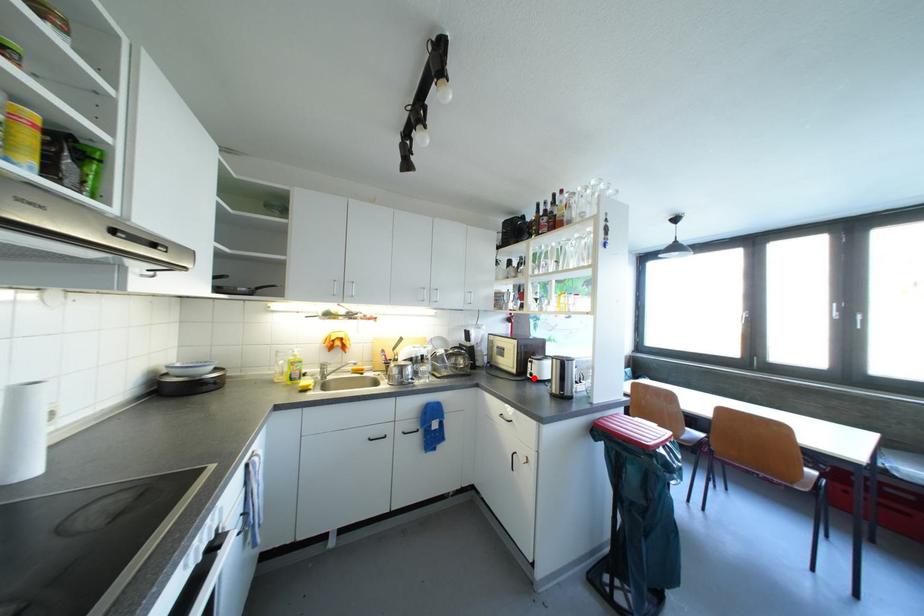
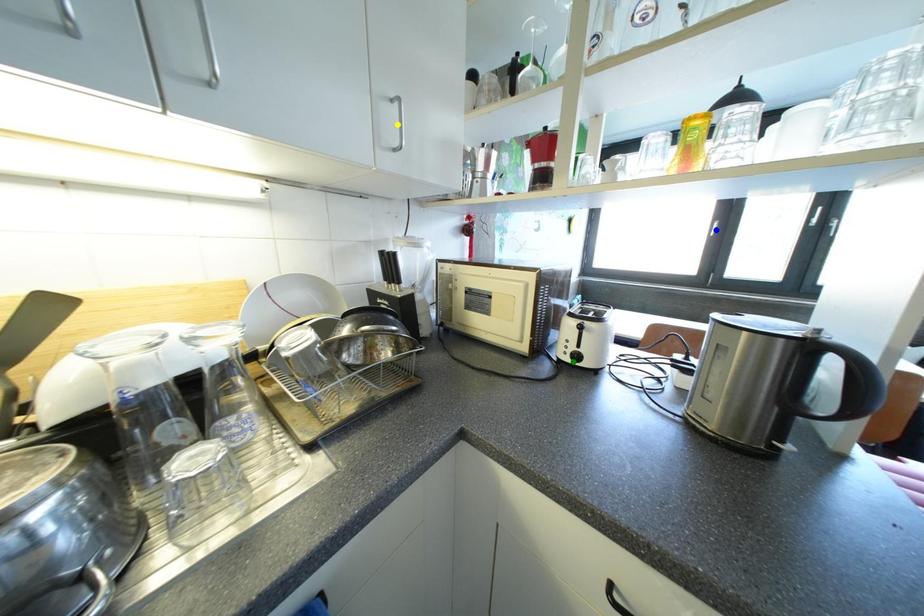
Question: I am providing you with two images of the same scene from different viewpoints. A red point is marked on the first image. You are given multiple points on the second image. Can you choose the point in image 2 that corresponds to the point in image 1?

Choices:
 (A) yellow point
 (B) blue point
 (C) green point

Answer: (C)